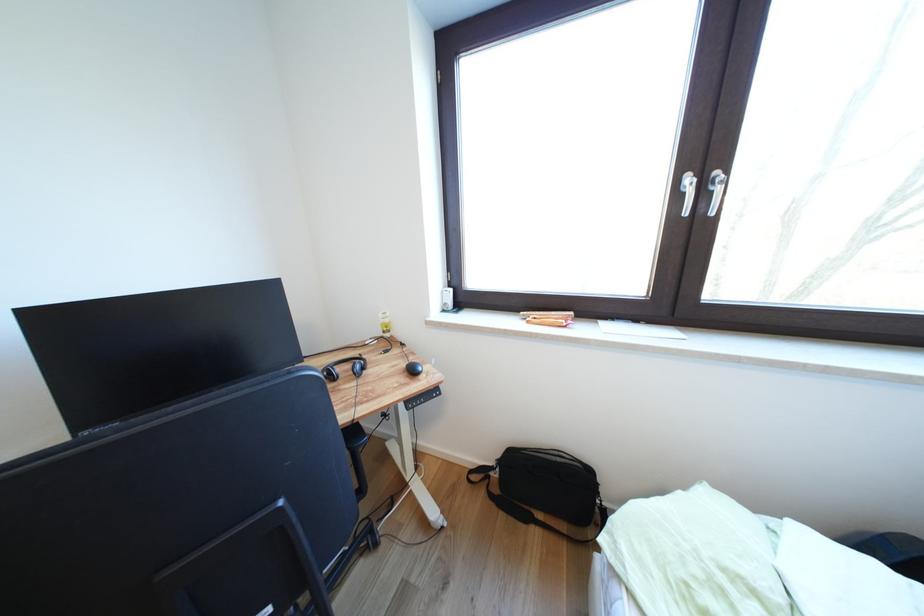
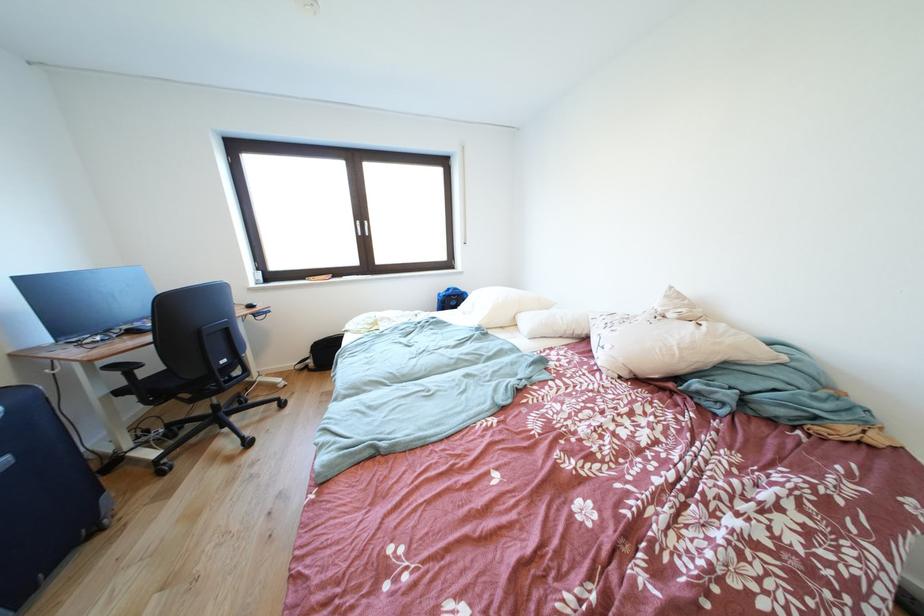
Locate, in the second image, the point that corresponds to (698,184) in the first image.

(367, 228)